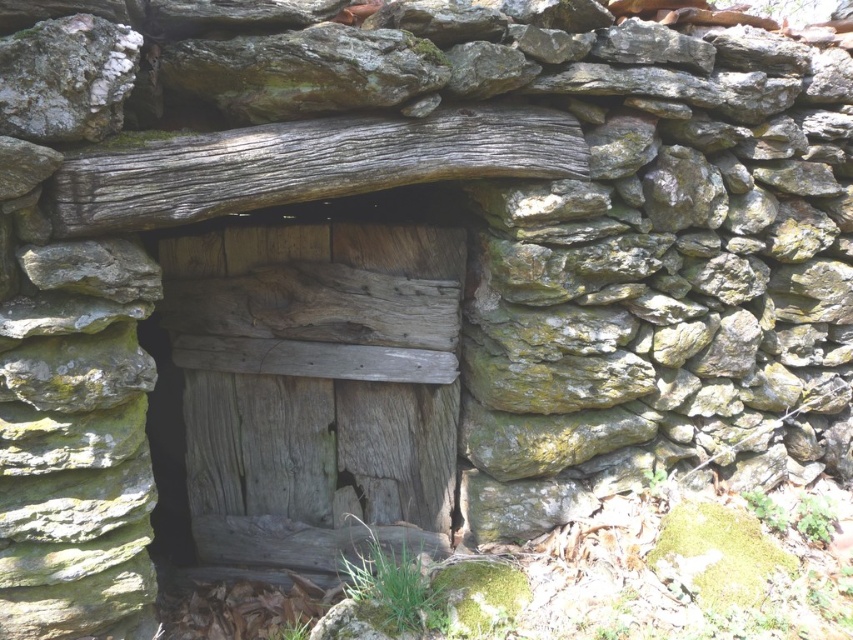
Is weathered wood door at center thinner than speckled gray rock at upper left?

No, weathered wood door at center is not thinner than speckled gray rock at upper left.

Does weathered wood door at center lie behind speckled gray rock at upper left?

Yes, weathered wood door at center is behind speckled gray rock at upper left.

At what (x,y) coordinates should I click in order to perform the action: click on weathered wood door at center. Please return your answer as a coordinate pair (x, y). Image resolution: width=853 pixels, height=640 pixels. Looking at the image, I should click on (316, 388).

Can you confirm if weathered wood door at center is shorter than weathered wood log at center?

Incorrect, weathered wood door at center's height does not fall short of weathered wood log at center's.

Locate an element on the screen. weathered wood door at center is located at coordinates (316, 388).

Identify the location of weathered wood door at center. (316, 388).

Can you confirm if weathered wood log at center is smaller than speckled gray rock at upper left?

No.

The image size is (853, 640). What are the coordinates of `weathered wood log at center` in the screenshot? It's located at (305, 164).

At what (x,y) coordinates should I click in order to perform the action: click on weathered wood log at center. Please return your answer as a coordinate pair (x, y). Image resolution: width=853 pixels, height=640 pixels. Looking at the image, I should click on (305, 164).